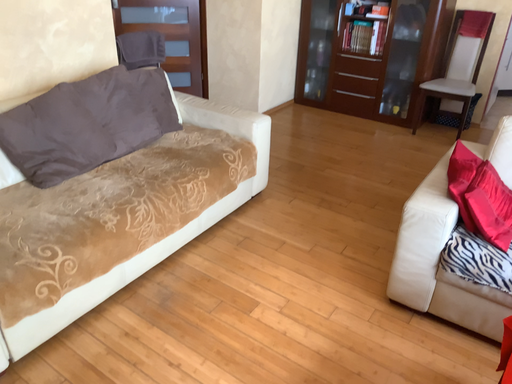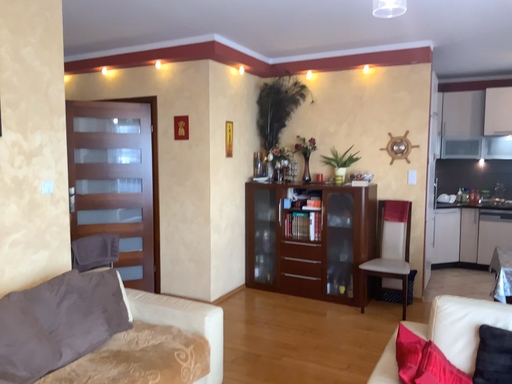
Question: Which way did the camera rotate in the video?

Choices:
 (A) rotated downward
 (B) rotated upward

Answer: (B)